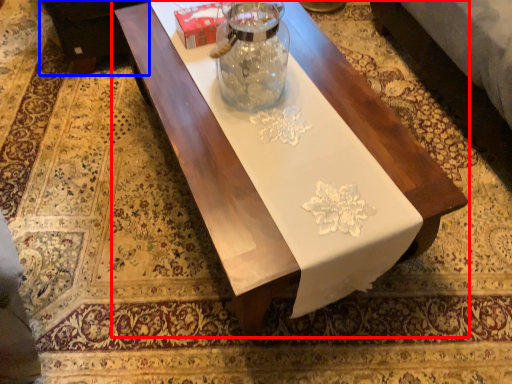
Question: Which of the following is the closest to the observer, table (highlighted by a red box) or couch (highlighted by a blue box)?

Choices:
 (A) table
 (B) couch

Answer: (A)